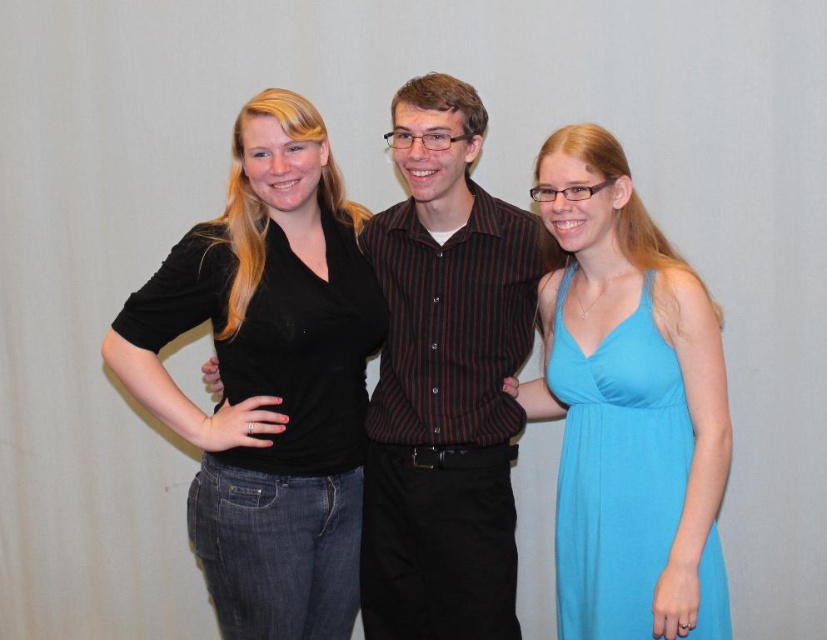
Between striped cotton shirt at center and matte blue dress at right, which one has less height?

matte blue dress at right

Does point (443, 252) lie in front of point (672, 369)?

No, it is not.

Identify the location of striped cotton shirt at center. (445, 380).

Consider the image. Can you confirm if black cotton shirt at center is positioned to the right of matte blue dress at right?

Incorrect, black cotton shirt at center is not on the right side of matte blue dress at right.

The height and width of the screenshot is (640, 827). What do you see at coordinates (269, 378) in the screenshot?
I see `black cotton shirt at center` at bounding box center [269, 378].

Identify the location of black cotton shirt at center. The width and height of the screenshot is (827, 640). (269, 378).

Is black cotton shirt at center to the left of striped cotton shirt at center from the viewer's perspective?

Correct, you'll find black cotton shirt at center to the left of striped cotton shirt at center.

The height and width of the screenshot is (640, 827). What are the coordinates of `black cotton shirt at center` in the screenshot? It's located at (269, 378).